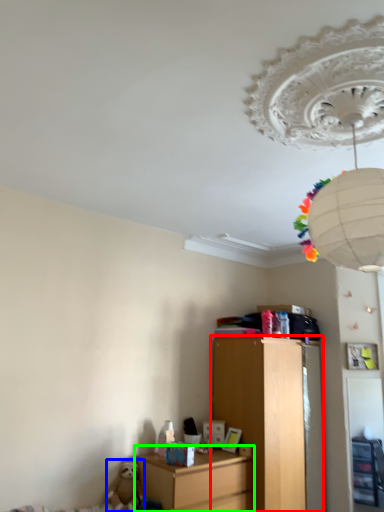
Question: Considering the real-world distances, which object is closest to chest of drawers (highlighted by a red box)? toy (highlighted by a blue box) or nightstand (highlighted by a green box).

Choices:
 (A) toy
 (B) nightstand

Answer: (B)